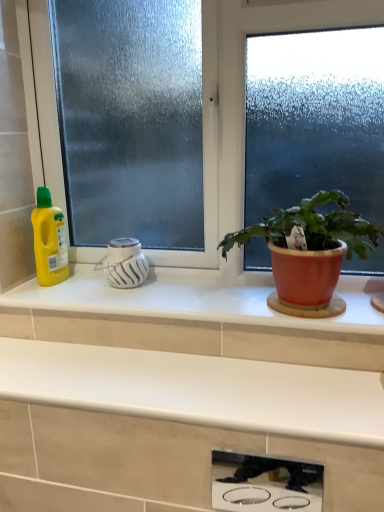
At what (x,y) coordinates should I click in order to perform the action: click on empty space that is in between matte terracotta pot at right and white matte diffuser at center, marked as the second appliance in a bottom-to-top arrangement. Please return your answer as a coordinate pair (x, y). This screenshot has height=512, width=384. Looking at the image, I should click on (171, 298).